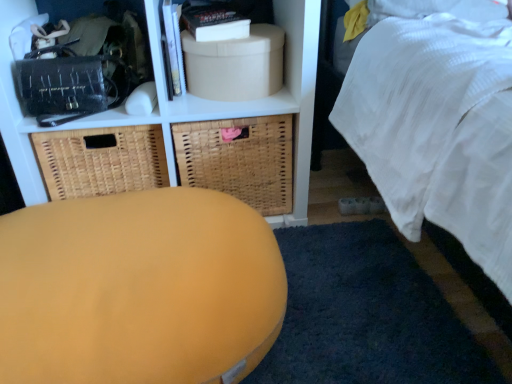
Question: Is point (240, 72) positioned closer to the camera than point (185, 21)?

Choices:
 (A) closer
 (B) farther

Answer: (A)

Question: Relative to matte black book at upper center, is beige cardboard box at upper center in front or behind?

Choices:
 (A) behind
 (B) front

Answer: (B)

Question: Estimate the real-world distances between objects in this image. Which object is closer to the matte black book at upper center?

Choices:
 (A) woven brown basket at left, the 2th basket positioned from the right
 (B) matte white shelf at upper center
 (C) matte yellow ottoman at center
 (D) woven brown basket at center, the first basket viewed from the right
 (E) beige cardboard box at upper center

Answer: (E)

Question: Which is nearer to the beige cardboard box at upper center?

Choices:
 (A) matte black book at upper center
 (B) matte white shelf at upper center
 (C) woven brown basket at left, the 2th basket positioned from the right
 (D) soft blue carpet at lower center
 (E) matte yellow ottoman at center

Answer: (A)